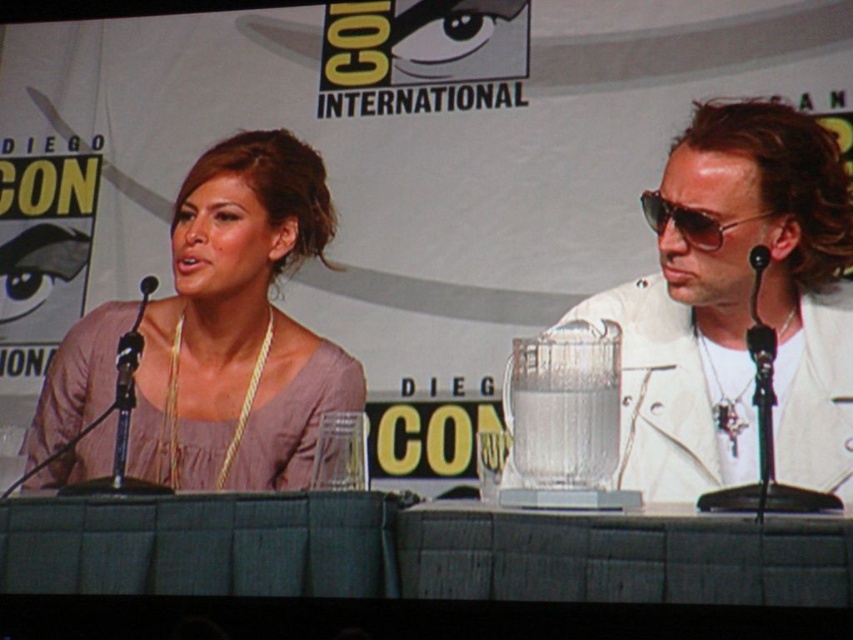
Based on the photo, you are attending Comic Con and want to take a photo of the panel discussion. You notice two points marked on the floor where attendees are standing. The first point is at coordinates point (x=625, y=390) and the second at point (x=134, y=429). If you want to position yourself so that both points are visible in your camera frame, which point should you stand closer to?

You should stand closer to point (x=134, y=429) because point (x=625, y=390) is in front of point (x=134, y=429). By positioning yourself near the rear point, you can see both the front and the back points in your camera frame.

You are a photographer at Comic Con trying to capture a closeup of the panel discussion. You have two points of interest marked as point 1 at coordinates [782,294] and point 2 at coordinates [683,216]. Which point is closer to your camera?

Point 1 at coordinates [782,294] is closer to the camera than point 2 at coordinates [683,216].

You are attending Comic Con and want to take a photo of the panelists. The matte pink blouse at left and sunglasses at right are both in your camera view. According to the scene, which object is positioned lower in the frame?

The matte pink blouse at left is positioned below sunglasses at right, so the matte pink blouse at left is lower in the frame.